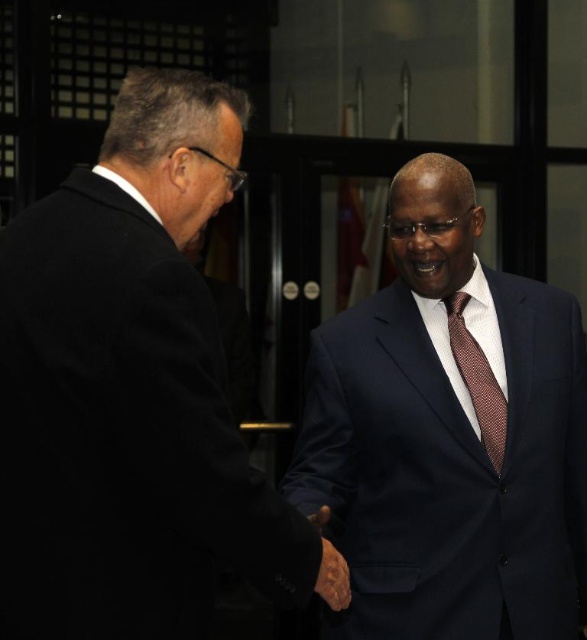
Which is above, navy blue suit at center or brown dotted tie at center?

Positioned higher is brown dotted tie at center.

Between navy blue suit at center and brown dotted tie at center, which one has more height?

Standing taller between the two is navy blue suit at center.

Is point (468, 412) less distant than point (488, 397)?

Yes, point (468, 412) is in front of point (488, 397).

Image resolution: width=587 pixels, height=640 pixels. In order to click on navy blue suit at center in this screenshot , I will do `click(450, 435)`.

Who is positioned more to the left, black suit at left or brown dotted tie at center?

black suit at left

Is point (18, 637) behind point (484, 390)?

No, it is not.

Identify the location of black suit at left. This screenshot has width=587, height=640. (133, 392).

The height and width of the screenshot is (640, 587). What do you see at coordinates (133, 392) in the screenshot?
I see `black suit at left` at bounding box center [133, 392].

Between point (63, 342) and point (376, 596), which one is positioned behind?

Point (376, 596)

Who is more distant from viewer, (x=193, y=502) or (x=409, y=442)?

The point (x=409, y=442) is behind.

Where is `black suit at left`? black suit at left is located at coordinates (133, 392).